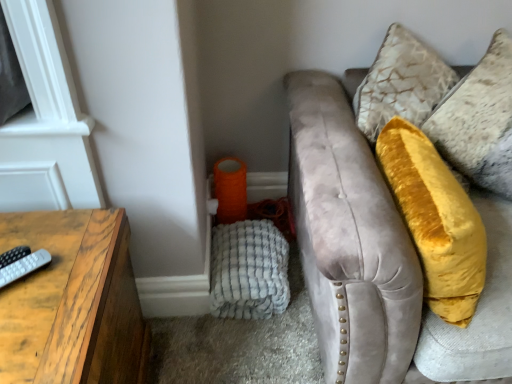
Question: In terms of size, does gray matte remote at left appear bigger or smaller than velvet yellow pillow at upper right?

Choices:
 (A) big
 (B) small

Answer: (B)

Question: From a real-world perspective, relative to velvet yellow pillow at upper right, is gray matte remote at left vertically above or below?

Choices:
 (A) above
 (B) below

Answer: (B)

Question: Estimate the real-world distances between objects in this image. Which object is closer to the velvet gray studio couch at right?

Choices:
 (A) gray matte remote at left
 (B) wooden table at left
 (C) white textured blanket at lower left
 (D) velvet yellow pillow at upper right

Answer: (D)

Question: Estimate the real-world distances between objects in this image. Which object is farther from the wooden table at left?

Choices:
 (A) white textured blanket at lower left
 (B) velvet gray studio couch at right
 (C) gray matte remote at left
 (D) velvet yellow pillow at upper right

Answer: (D)